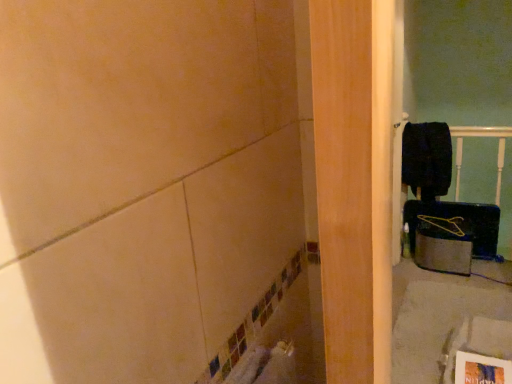
Consider the image. Measure the distance between yellow plastic hanger at right and camera.

8.90 feet.

What is the approximate width of yellow plastic hanger at right?

It is 11.86 inches.

The width and height of the screenshot is (512, 384). Describe the element at coordinates (443, 224) in the screenshot. I see `yellow plastic hanger at right` at that location.

This screenshot has width=512, height=384. I want to click on yellow plastic hanger at right, so click(x=443, y=224).

What is the approximate height of black matte laundry at upper right?

black matte laundry at upper right is 19.19 inches tall.

The image size is (512, 384). I want to click on black matte laundry at upper right, so click(426, 159).

The image size is (512, 384). What do you see at coordinates (426, 159) in the screenshot?
I see `black matte laundry at upper right` at bounding box center [426, 159].

Locate an element on the screen. This screenshot has height=384, width=512. yellow plastic hanger at right is located at coordinates (443, 224).

Can you confirm if black matte laundry at upper right is positioned to the right of yellow plastic hanger at right?

Incorrect, black matte laundry at upper right is not on the right side of yellow plastic hanger at right.

Between black matte laundry at upper right and yellow plastic hanger at right, which one is positioned behind?

black matte laundry at upper right is behind.

Which is behind, point (445, 193) or point (441, 222)?

Positioned behind is point (445, 193).

From the image's perspective, who appears lower, black matte laundry at upper right or yellow plastic hanger at right?

yellow plastic hanger at right.

From a real-world perspective, is black matte laundry at upper right beneath yellow plastic hanger at right?

No, from a real-world perspective, black matte laundry at upper right is not under yellow plastic hanger at right.

Does black matte laundry at upper right have a lesser width compared to yellow plastic hanger at right?

Correct, the width of black matte laundry at upper right is less than that of yellow plastic hanger at right.

Is black matte laundry at upper right taller than yellow plastic hanger at right?

Correct, black matte laundry at upper right is much taller as yellow plastic hanger at right.

Considering the relative sizes of black matte laundry at upper right and yellow plastic hanger at right in the image provided, is black matte laundry at upper right bigger than yellow plastic hanger at right?

Yes, black matte laundry at upper right is bigger than yellow plastic hanger at right.

Is yellow plastic hanger at right surrounded by black matte laundry at upper right?

No, yellow plastic hanger at right is not a part of black matte laundry at upper right.

Are black matte laundry at upper right and yellow plastic hanger at right beside each other?

No, black matte laundry at upper right is not making contact with yellow plastic hanger at right.

Is black matte laundry at upper right facing towards yellow plastic hanger at right?

No, black matte laundry at upper right is not aimed at yellow plastic hanger at right.

Can you tell me how much black matte laundry at upper right and yellow plastic hanger at right differ in facing direction?

The angular difference between black matte laundry at upper right and yellow plastic hanger at right is 4.94 degrees.

Measure the distance from black matte laundry at upper right to yellow plastic hanger at right.

black matte laundry at upper right is 13.82 inches from yellow plastic hanger at right.

Find the location of `job lying below the black matte laundry at upper right (from the image's perspective)`. job lying below the black matte laundry at upper right (from the image's perspective) is located at coordinates (443, 224).

Is yellow plastic hanger at right to the right of black matte laundry at upper right from the viewer's perspective?

Indeed, yellow plastic hanger at right is positioned on the right side of black matte laundry at upper right.

In the image, is yellow plastic hanger at right positioned in front of or behind black matte laundry at upper right?

Clearly, yellow plastic hanger at right is in front of black matte laundry at upper right.

Is point (442, 230) closer or farther from the camera than point (416, 189)?

Point (442, 230).

From the image's perspective, is yellow plastic hanger at right below black matte laundry at upper right?

Correct, yellow plastic hanger at right appears lower than black matte laundry at upper right in the image.

From a real-world perspective, who is located higher, yellow plastic hanger at right or black matte laundry at upper right?

In real-world perspective, black matte laundry at upper right is above.

Considering the sizes of yellow plastic hanger at right and black matte laundry at upper right in the image, is yellow plastic hanger at right wider or thinner than black matte laundry at upper right?

Clearly, yellow plastic hanger at right has more width compared to black matte laundry at upper right.

Considering the relative sizes of yellow plastic hanger at right and black matte laundry at upper right in the image provided, is yellow plastic hanger at right taller than black matte laundry at upper right?

Incorrect, the height of yellow plastic hanger at right is not larger of that of black matte laundry at upper right.

Considering the sizes of yellow plastic hanger at right and black matte laundry at upper right in the image, is yellow plastic hanger at right bigger or smaller than black matte laundry at upper right?

yellow plastic hanger at right is smaller than black matte laundry at upper right.

Is black matte laundry at upper right completely or partially inside yellow plastic hanger at right?

No, black matte laundry at upper right is not a part of yellow plastic hanger at right.

Is yellow plastic hanger at right placed right next to black matte laundry at upper right?

No, yellow plastic hanger at right is not making contact with black matte laundry at upper right.

Is yellow plastic hanger at right facing away from black matte laundry at upper right?

No, black matte laundry at upper right is not at the back of yellow plastic hanger at right.

How many degrees apart are the facing directions of yellow plastic hanger at right and black matte laundry at upper right?

4.94 degrees separate the facing orientations of yellow plastic hanger at right and black matte laundry at upper right.

Identify the location of job on the right of black matte laundry at upper right. The width and height of the screenshot is (512, 384). (443, 224).

Identify the location of laundry above the yellow plastic hanger at right (from a real-world perspective). The image size is (512, 384). (426, 159).

Find the location of a particular element. job in front of the black matte laundry at upper right is located at coordinates (443, 224).